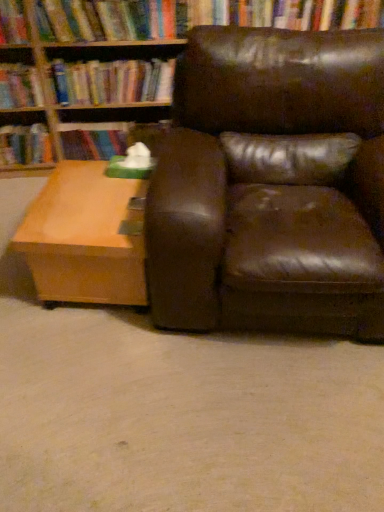
Identify the location of blank area beneath hardcover book at upper center, which ranks as the 4th book in left-to-right order (from a real-world perspective). (105, 128).